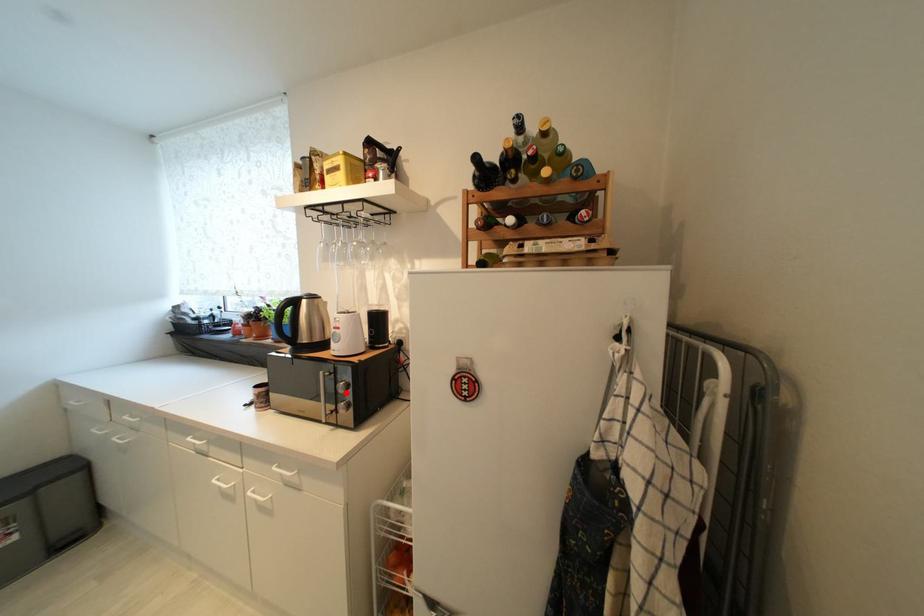
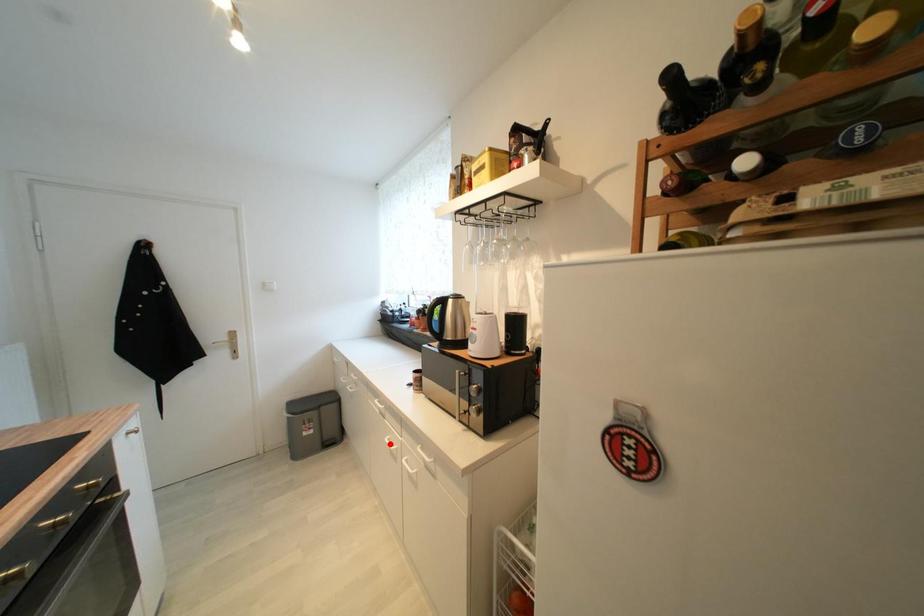
I am providing you with two images of the same scene from different viewpoints. A red point is marked on the first image and another point is marked on the second image. Does the point marked in image1 correspond to the same location as the one in image2?

No